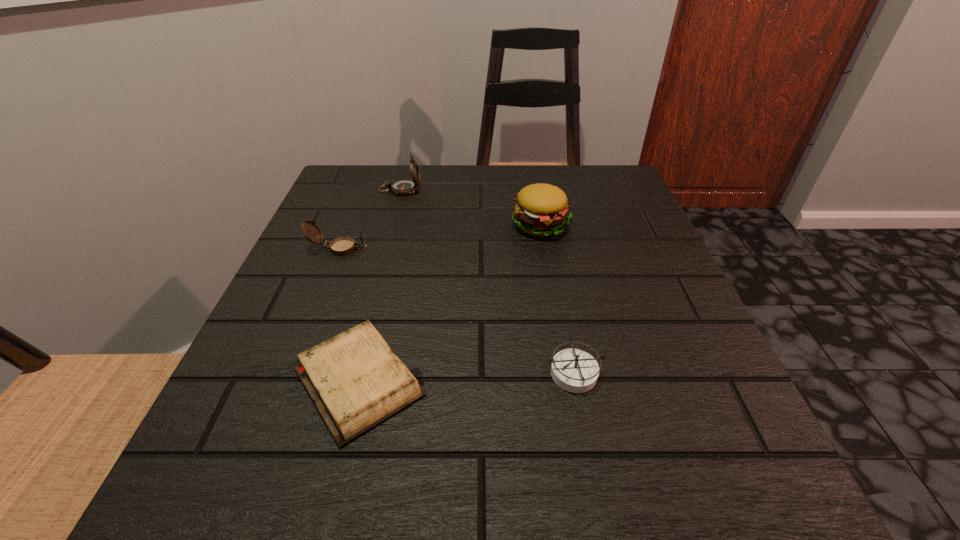
Locate an element on the screen. This screenshot has height=540, width=960. free region located 0.260m on the face of the third shortest object is located at coordinates (500, 249).

Locate an element on the screen. The height and width of the screenshot is (540, 960). free spot located on the left of the rightmost compass is located at coordinates (354, 372).

Identify the location of blank space located on the right of the diary. The width and height of the screenshot is (960, 540). (477, 381).

Find the location of `compass that is at the far edge`. compass that is at the far edge is located at coordinates (403, 186).

You are a GUI agent. You are given a task and a screenshot of the screen. Output one action in this format:
    pyautogui.click(x=<x>, y=<y>)
    Task: Click on the hamburger that is at the far edge
    
    Given the screenshot: What is the action you would take?
    pyautogui.click(x=541, y=210)

I want to click on object that is at the near edge, so click(356, 381).

At what (x,y) coordinates should I click in order to perform the action: click on diary that is at the left edge. Please return your answer as a coordinate pair (x, y). This screenshot has height=540, width=960. Looking at the image, I should click on (356, 381).

Where is `object present at the right edge`? The width and height of the screenshot is (960, 540). object present at the right edge is located at coordinates (541, 210).

Locate an element on the screen. This screenshot has height=540, width=960. object situated at the far left corner is located at coordinates (403, 186).

The width and height of the screenshot is (960, 540). Identify the location of object that is at the near left corner. (356, 381).